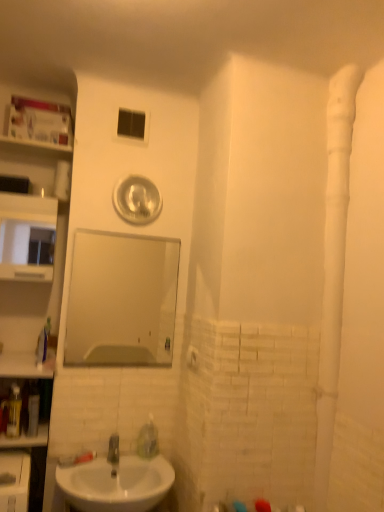
Question: From a real-world perspective, is clear glass mirror at center above or below white glossy sink at lower left?

Choices:
 (A) below
 (B) above

Answer: (B)

Question: In terms of size, does clear glass mirror at center appear bigger or smaller than white glossy sink at lower left?

Choices:
 (A) small
 (B) big

Answer: (A)

Question: Which of these objects is positioned farthest from the white matte water pipe at right?

Choices:
 (A) matte white medicine cabinet at left
 (B) white cardboard box at upper left
 (C) white glossy sink at lower left
 (D) clear glass mirror at center
 (E) translucent plastic bottle at left

Answer: (E)

Question: Estimate the real-world distances between objects in this image. Which object is farther from the transparent plastic window at upper center?

Choices:
 (A) translucent plastic bottle at left
 (B) white matte water pipe at right
 (C) clear glass mirror at center
 (D) white glossy sink at lower left
 (E) matte white medicine cabinet at left

Answer: (D)